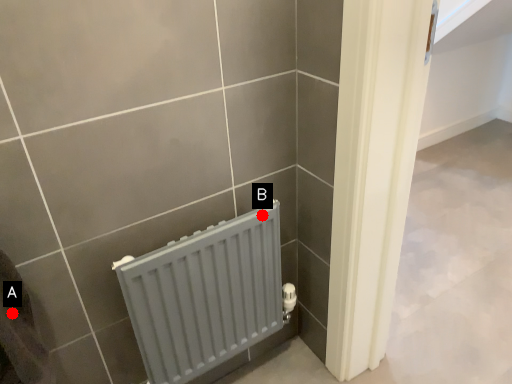
Question: Two points are circled on the image, labeled by A and B beside each circle. Which point is closer to the camera taking this photo?

Choices:
 (A) A is closer
 (B) B is closer

Answer: (A)